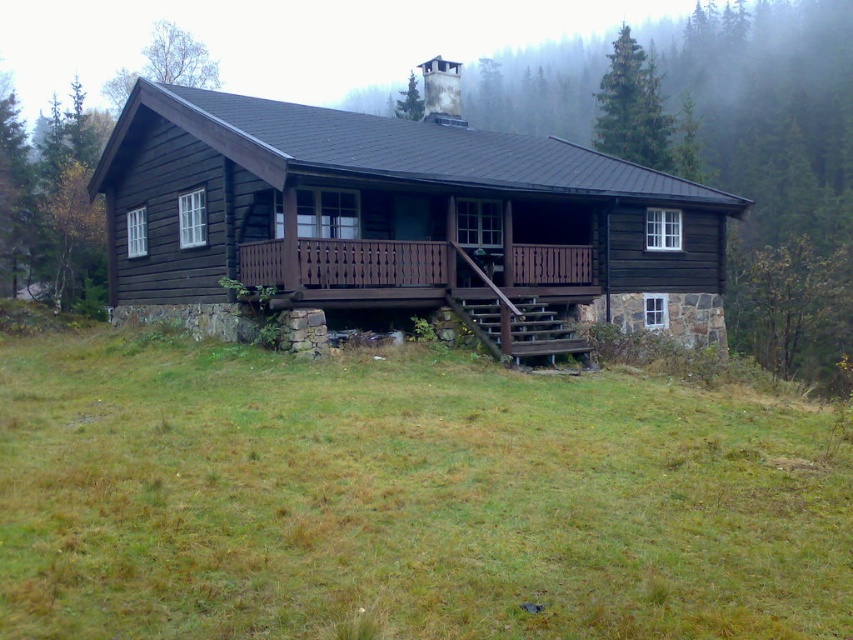
Between green grass at lower center and green leafy tree at upper left, which one is positioned higher?

green leafy tree at upper left

Between point (190, 612) and point (149, 44), which one is positioned behind?

Positioned behind is point (149, 44).

The width and height of the screenshot is (853, 640). I want to click on green grass at lower center, so click(x=403, y=499).

Can you confirm if green grass at lower center is taller than green textured tree at upper center?

In fact, green grass at lower center may be shorter than green textured tree at upper center.

Can you confirm if green grass at lower center is bigger than green textured tree at upper center?

No, green grass at lower center is not bigger than green textured tree at upper center.

This screenshot has height=640, width=853. What are the coordinates of `green grass at lower center` in the screenshot? It's located at (403, 499).

Where is `green grass at lower center`? The height and width of the screenshot is (640, 853). green grass at lower center is located at coordinates 403,499.

Based on the photo, how much distance is there between green matte tree at upper center and green leafy tree at upper left?

green matte tree at upper center is 214.86 feet away from green leafy tree at upper left.

Can you confirm if green matte tree at upper center is taller than green leafy tree at upper left?

No, green matte tree at upper center is not taller than green leafy tree at upper left.

Where is `green matte tree at upper center`? The height and width of the screenshot is (640, 853). green matte tree at upper center is located at coordinates (631, 108).